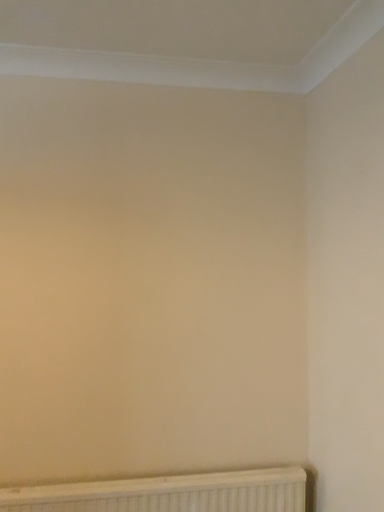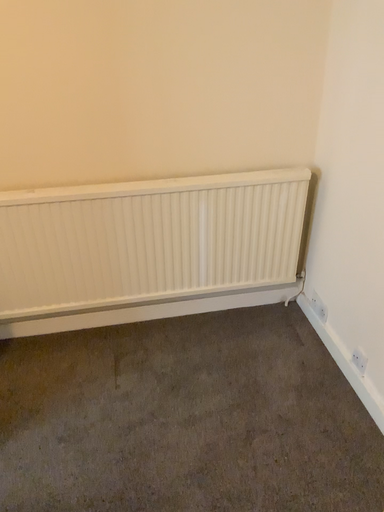
Question: How did the camera likely rotate when shooting the video?

Choices:
 (A) rotated upward
 (B) rotated downward

Answer: (B)